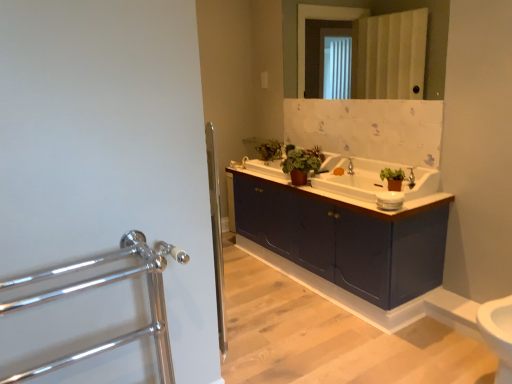
Question: Is there a large distance between polished chrome towel rack at left and matte blue cabinet at center?

Choices:
 (A) no
 (B) yes

Answer: (B)

Question: Is the depth of polished chrome towel rack at left less than that of matte blue cabinet at center?

Choices:
 (A) no
 (B) yes

Answer: (B)

Question: Could you tell me if polished chrome towel rack at left is turned towards matte blue cabinet at center?

Choices:
 (A) yes
 (B) no

Answer: (B)

Question: Can you confirm if polished chrome towel rack at left is shorter than matte blue cabinet at center?

Choices:
 (A) yes
 (B) no

Answer: (B)

Question: Is polished chrome towel rack at left to the left of matte blue cabinet at center from the viewer's perspective?

Choices:
 (A) yes
 (B) no

Answer: (A)

Question: Based on their sizes in the image, would you say green matte plant at center, marked as the first plant in a front-to-back arrangement, is bigger or smaller than green matte plant at upper center, arranged as the first plant when viewed from the back?

Choices:
 (A) big
 (B) small

Answer: (B)

Question: Is green matte plant at center, the second plant viewed from the back, in front of or behind green matte plant at upper center, arranged as the first plant when viewed from the back, in the image?

Choices:
 (A) behind
 (B) front

Answer: (B)

Question: Is green matte plant at center, placed as the first plant when sorted from right to left, to the left or to the right of green matte plant at upper center, arranged as the first plant when viewed from the back, in the image?

Choices:
 (A) right
 (B) left

Answer: (A)

Question: From a real-world perspective, relative to green matte plant at upper center, which ranks as the 1th plant in left-to-right order, is green matte plant at center, the second plant viewed from the back, vertically above or below?

Choices:
 (A) below
 (B) above

Answer: (A)

Question: Considering the positions of point click(218, 243) and point click(352, 165), is point click(218, 243) closer or farther from the camera than point click(352, 165)?

Choices:
 (A) farther
 (B) closer

Answer: (B)

Question: Considering the positions of clear glass screen door at center and matte silver faucet at center in the image, is clear glass screen door at center bigger or smaller than matte silver faucet at center?

Choices:
 (A) small
 (B) big

Answer: (B)

Question: Looking at their shapes, would you say clear glass screen door at center is wider or thinner than matte silver faucet at center?

Choices:
 (A) wide
 (B) thin

Answer: (B)

Question: Considering the positions of clear glass screen door at center and matte silver faucet at center in the image, is clear glass screen door at center taller or shorter than matte silver faucet at center?

Choices:
 (A) tall
 (B) short

Answer: (A)

Question: From the image's perspective, relative to matte silver faucet at center, is green matte plant at upper center, the second plant viewed from the front, above or below?

Choices:
 (A) below
 (B) above

Answer: (B)

Question: Considering the positions of green matte plant at upper center, marked as the second plant in a right-to-left arrangement, and matte silver faucet at center in the image, is green matte plant at upper center, marked as the second plant in a right-to-left arrangement, taller or shorter than matte silver faucet at center?

Choices:
 (A) short
 (B) tall

Answer: (B)